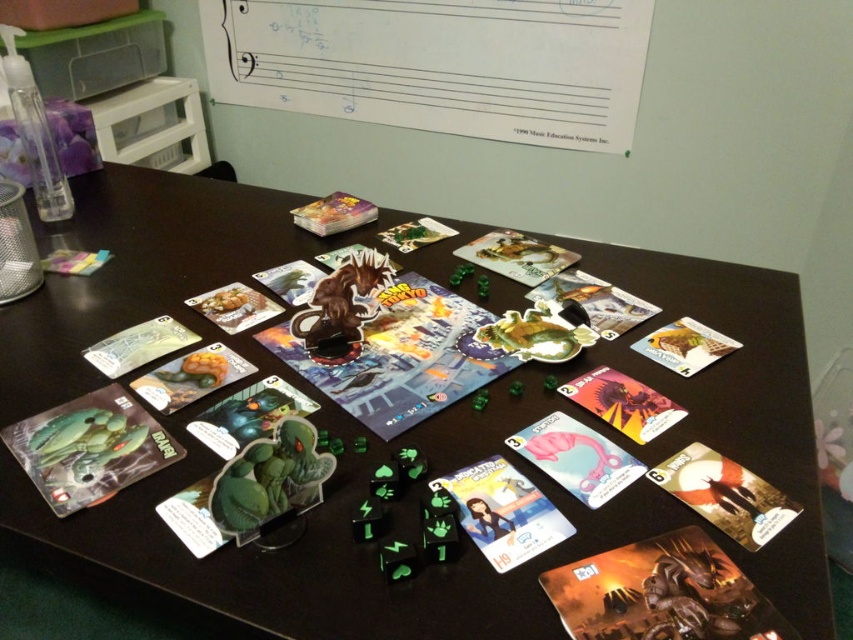
Is point (216, 275) farther from viewer compared to point (467, 477)?

Yes, point (216, 275) is behind point (467, 477).

Between black plastic table at center and matte plastic postcard at center, which one appears on the left side from the viewer's perspective?

black plastic table at center

This screenshot has height=640, width=853. What do you see at coordinates (392, 440) in the screenshot?
I see `black plastic table at center` at bounding box center [392, 440].

At what (x,y) coordinates should I click in order to perform the action: click on black plastic table at center. Please return your answer as a coordinate pair (x, y). This screenshot has height=640, width=853. Looking at the image, I should click on (392, 440).